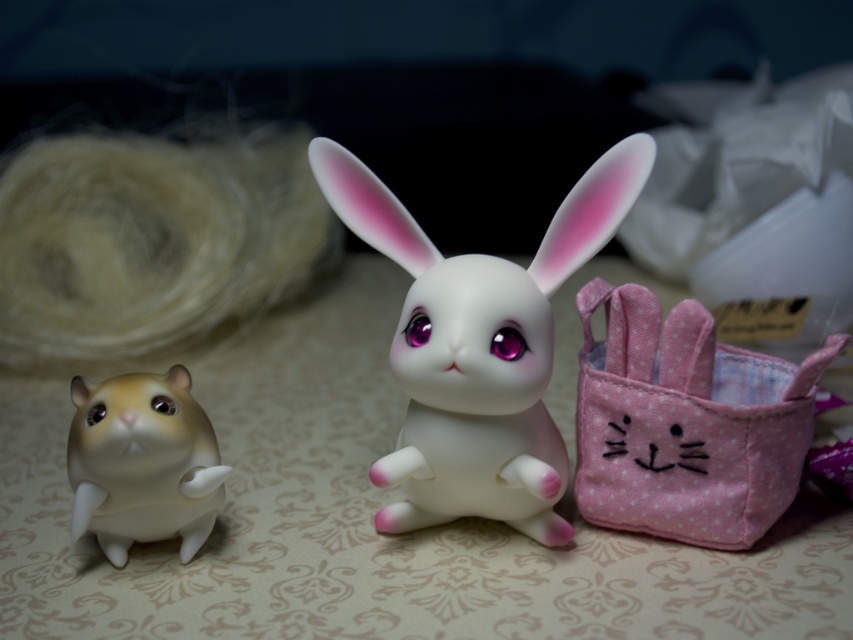
Question: Considering the real-world distances, which object is farthest from the white glossy rabbit at center?

Choices:
 (A) pink fabric basket at right
 (B) matte white rabbit at center

Answer: (B)

Question: Which point is farther to the camera?

Choices:
 (A) pink fabric basket at right
 (B) white glossy rabbit at center

Answer: (B)

Question: Does white glossy rabbit at center appear on the right side of pink fabric basket at right?

Choices:
 (A) no
 (B) yes

Answer: (A)

Question: Can you confirm if white glossy rabbit at center is wider than matte white rabbit at center?

Choices:
 (A) no
 (B) yes

Answer: (B)

Question: Is pink fabric basket at right to the right of matte white rabbit at center from the viewer's perspective?

Choices:
 (A) no
 (B) yes

Answer: (B)

Question: Estimate the real-world distances between objects in this image. Which object is closer to the matte white rabbit at center?

Choices:
 (A) pink fabric basket at right
 (B) white glossy rabbit at center

Answer: (B)